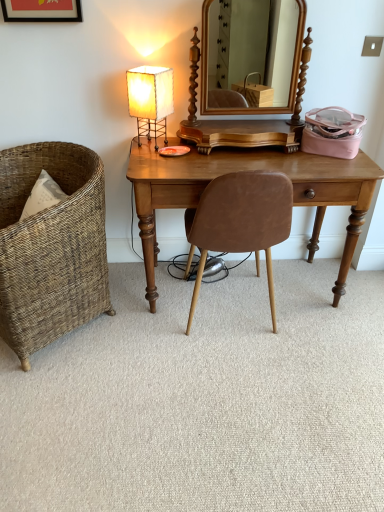
Identify the location of vacant region in front of brown leather chair at center, placed as the second chair when sorted from left to right. The height and width of the screenshot is (512, 384). (244, 378).